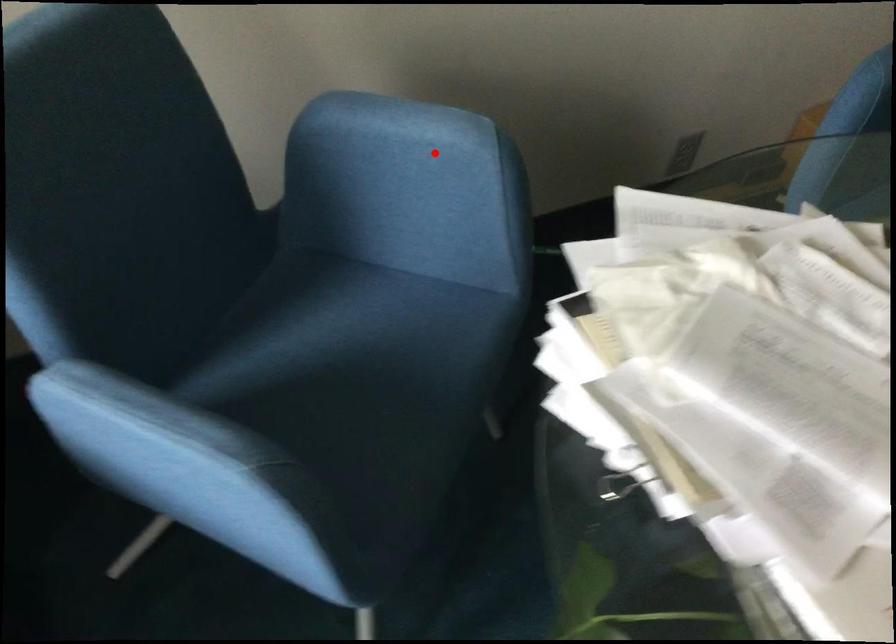
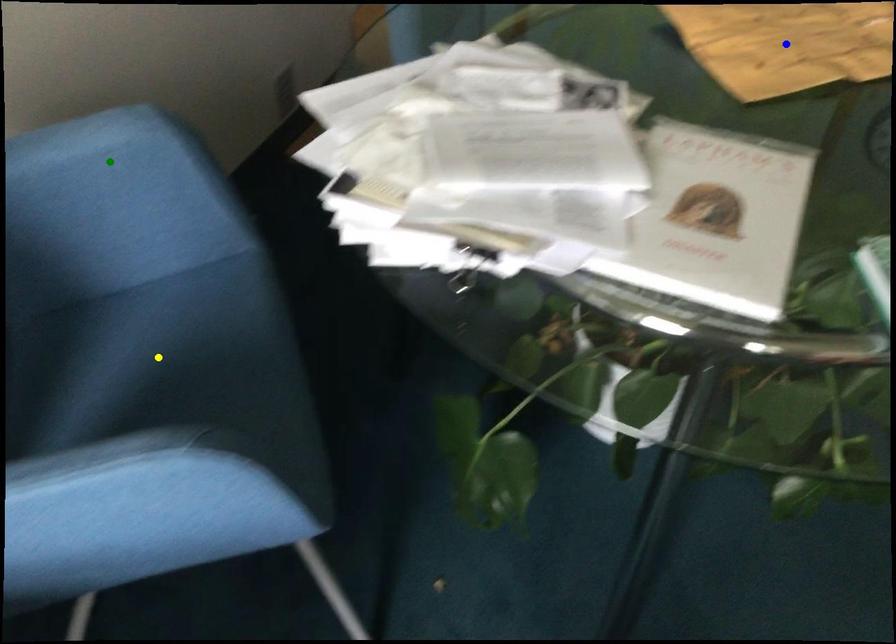
Question: I am providing you with two images of the same scene from different viewpoints. A red point is marked on the first image. You are given multiple points on the second image. Can you choose the point in image 2 that corresponds to the point in image 1?

Choices:
 (A) blue point
 (B) green point
 (C) yellow point

Answer: (B)